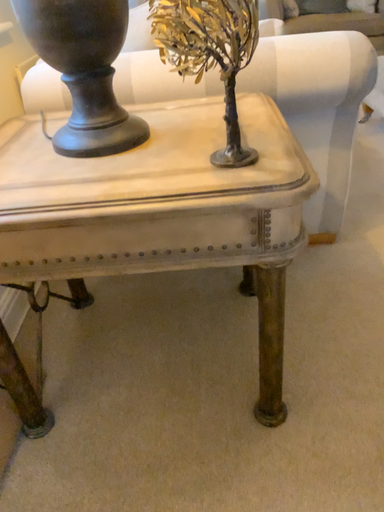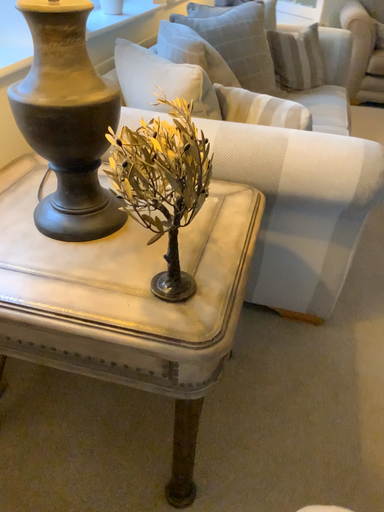
Question: How did the camera likely rotate when shooting the video?

Choices:
 (A) rotated right
 (B) rotated left

Answer: (B)